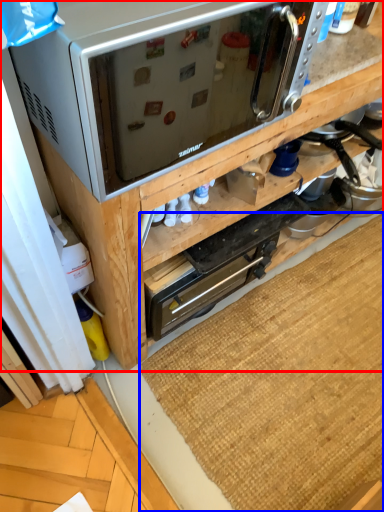
Question: Which object is further to the camera taking this photo, cabinetry (highlighted by a red box) or doormat (highlighted by a blue box)?

Choices:
 (A) cabinetry
 (B) doormat

Answer: (B)